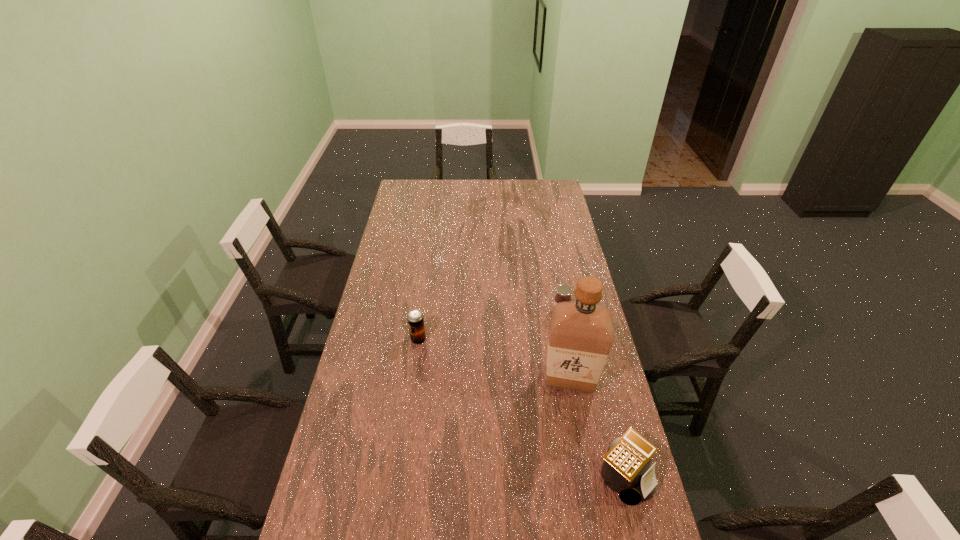
At what (x,y) coordinates should I click in order to perform the action: click on vacant area between the third nearest object and the jam. Please return your answer as a coordinate pair (x, y). This screenshot has height=540, width=960. Looking at the image, I should click on (490, 326).

Where is `object that is the second closest to the nearest object`? This screenshot has width=960, height=540. object that is the second closest to the nearest object is located at coordinates (564, 291).

The height and width of the screenshot is (540, 960). What are the coordinates of `object that is the third closest one to the jam` in the screenshot? It's located at (625, 470).

Find the location of `blank space that satisfies the following two spatial constraints: 1. on the front side of the third farthest object; 2. on the left side of the second farthest object`. blank space that satisfies the following two spatial constraints: 1. on the front side of the third farthest object; 2. on the left side of the second farthest object is located at coordinates (413, 378).

Identify the location of vacant point that satisfies the following two spatial constraints: 1. on the front side of the beer can; 2. on the right side of the calculator. The width and height of the screenshot is (960, 540). (399, 476).

I want to click on free space that satisfies the following two spatial constraints: 1. on the front side of the nearest object; 2. on the right side of the tallest object, so [x=588, y=476].